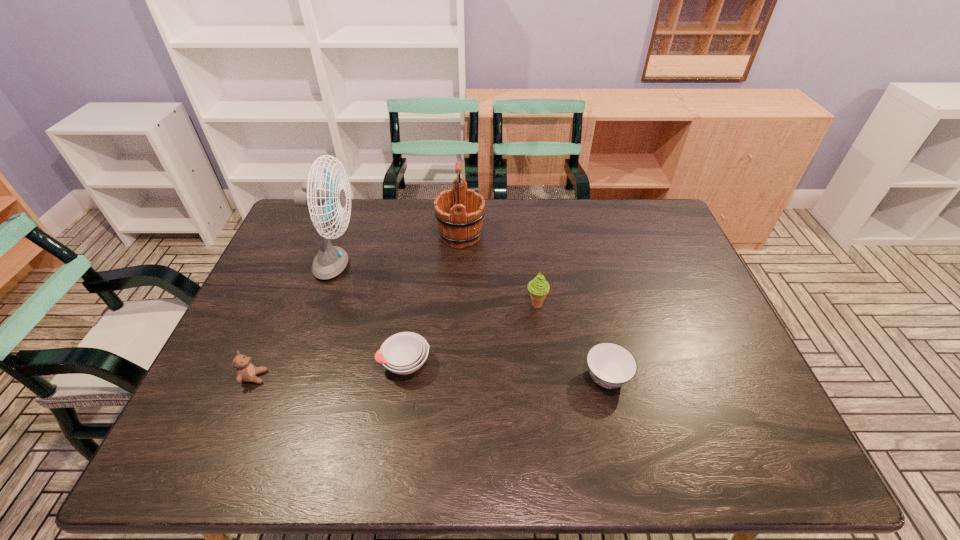
Where is `free spot that satisfies the following two spatial constraints: 1. on the front-facing side of the tallest object; 2. on the left side of the rightmost object`? The height and width of the screenshot is (540, 960). free spot that satisfies the following two spatial constraints: 1. on the front-facing side of the tallest object; 2. on the left side of the rightmost object is located at coordinates (299, 377).